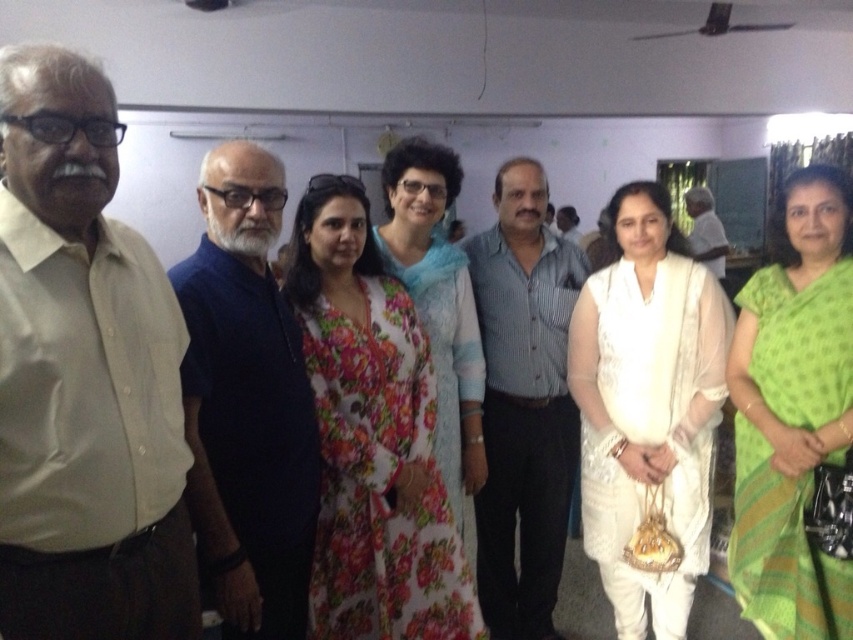
Question: Considering the relative positions of striped cotton shirt at center and white cotton shirt at center in the image provided, where is striped cotton shirt at center located with respect to white cotton shirt at center?

Choices:
 (A) left
 (B) right

Answer: (A)

Question: Does white silk saree at center appear on the right side of white cotton shirt at center?

Choices:
 (A) no
 (B) yes

Answer: (A)

Question: Estimate the real-world distances between objects in this image. Which object is closer to the white cotton shirt at center?

Choices:
 (A) striped cotton shirt at center
 (B) dark blue shirt at center
 (C) white silk saree at center

Answer: (A)

Question: Does beige shirt at left appear over dark blue shirt at center?

Choices:
 (A) no
 (B) yes

Answer: (B)

Question: Among these objects, which one is farthest from the camera?

Choices:
 (A) white silk saree at center
 (B) striped cotton shirt at center
 (C) beige shirt at left
 (D) dark blue shirt at center

Answer: (B)

Question: Considering the real-world distances, which object is farthest from the beige shirt at left?

Choices:
 (A) striped cotton shirt at center
 (B) white cotton shirt at center

Answer: (B)